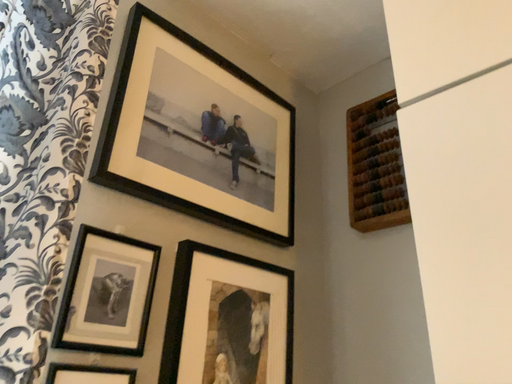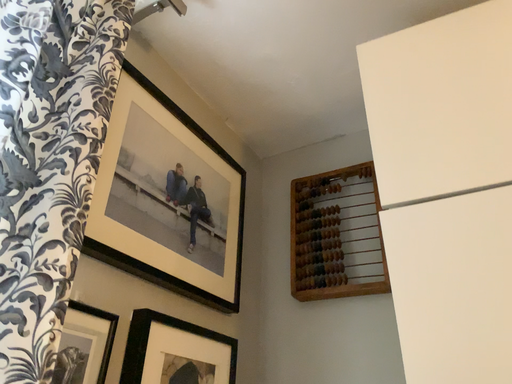
Question: How did the camera likely rotate when shooting the video?

Choices:
 (A) rotated left
 (B) rotated right

Answer: (B)